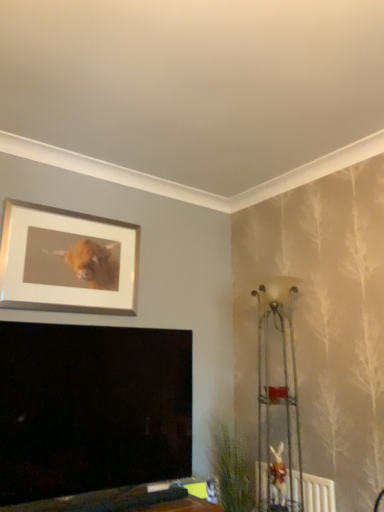
Question: Is metallic wire rack at right inside or outside of silver/metallic picture frame at upper left?

Choices:
 (A) inside
 (B) outside

Answer: (B)

Question: Is metallic wire rack at right wider or thinner than silver/metallic picture frame at upper left?

Choices:
 (A) thin
 (B) wide

Answer: (B)

Question: Estimate the real-world distances between objects in this image. Which object is closer to the metallic wire rack at right?

Choices:
 (A) silver/metallic picture frame at upper left
 (B) white textured radiator at lower right
 (C) green leafy plant at lower right

Answer: (B)

Question: Estimate the real-world distances between objects in this image. Which object is closer to the green leafy plant at lower right?

Choices:
 (A) silver/metallic picture frame at upper left
 (B) white textured radiator at lower right
 (C) metallic wire rack at right

Answer: (B)